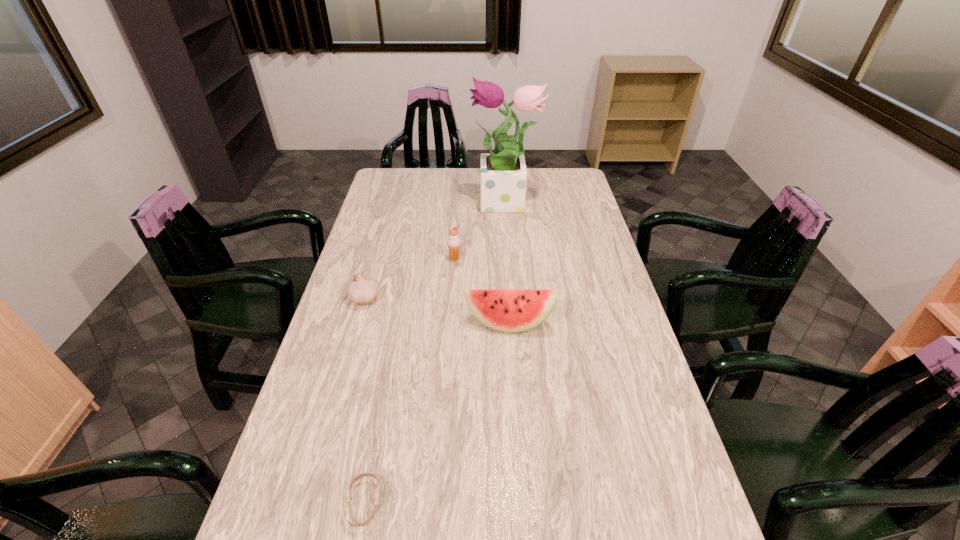
The width and height of the screenshot is (960, 540). In order to click on free space at the right edge in this screenshot , I will do `click(610, 428)`.

The image size is (960, 540). Identify the location of free space at the far right corner of the desktop. (557, 186).

This screenshot has height=540, width=960. Find the location of `free space between the shortest object and the second nearest object`. free space between the shortest object and the second nearest object is located at coordinates (x=437, y=413).

Locate an element on the screen. The height and width of the screenshot is (540, 960). vacant area that lies between the tallest object and the fourth object from right to left is located at coordinates (435, 354).

Locate an element on the screen. The width and height of the screenshot is (960, 540). vacant space that's between the fourth tallest object and the nearest object is located at coordinates (364, 401).

Locate an element on the screen. free area in between the farthest object and the second nearest object is located at coordinates (506, 264).

The image size is (960, 540). Find the location of `free space between the shortest object and the third object from right to left`. free space between the shortest object and the third object from right to left is located at coordinates click(x=410, y=381).

Locate an element on the screen. empty location between the icecream and the tallest object is located at coordinates (480, 231).

Find the location of `free spot between the third farthest object and the second object from left to right`. free spot between the third farthest object and the second object from left to right is located at coordinates (364, 401).

The height and width of the screenshot is (540, 960). In order to click on free point between the watermelon and the farthest object in this screenshot , I will do `click(506, 264)`.